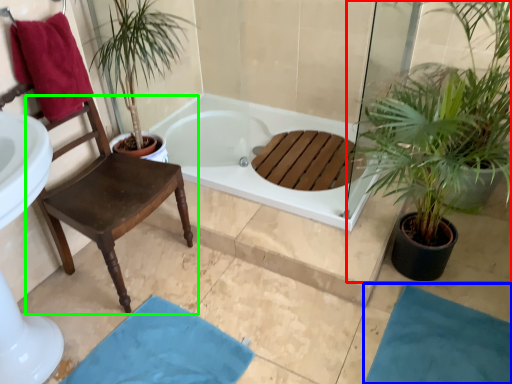
Question: Based on their relative distances, which object is nearer to houseplant (highlighted by a red box)? Choose from bath mat (highlighted by a blue box) and chair (highlighted by a green box).

Choices:
 (A) bath mat
 (B) chair

Answer: (A)